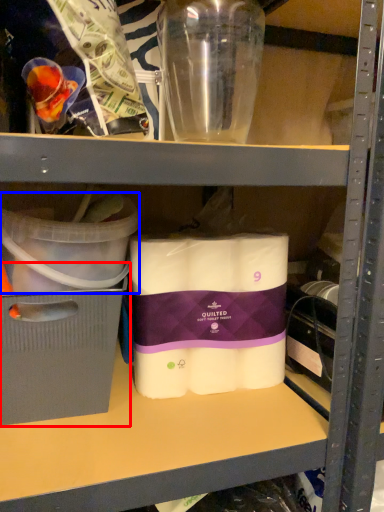
Question: Which object appears farthest to the camera in this image, storage box (highlighted by a red box) or storage box (highlighted by a blue box)?

Choices:
 (A) storage box
 (B) storage box

Answer: (A)